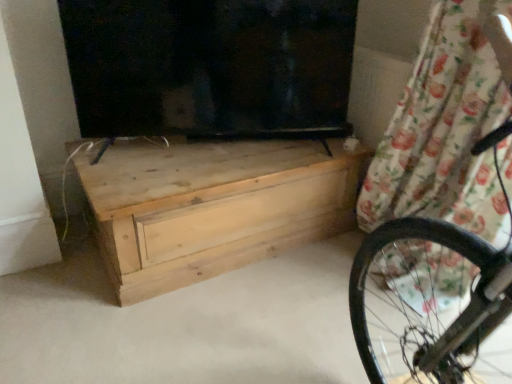
Locate an element on the screen. The image size is (512, 384). free space in front of natural wood chest of drawers at center is located at coordinates (200, 315).